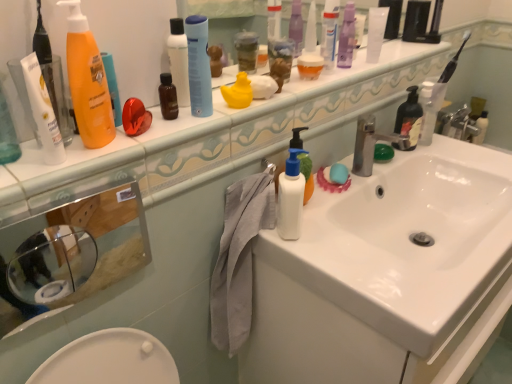
You are a GUI agent. You are given a task and a screenshot of the screen. Output one action in this format:
    pyautogui.click(x=<x>, y=<y>)
    Task: Click on the vacant space in front of purple glossy bottle at upper center, acting as the fourth toiletry starting from the left
    The height and width of the screenshot is (384, 512).
    Given the screenshot: What is the action you would take?
    pyautogui.click(x=347, y=72)